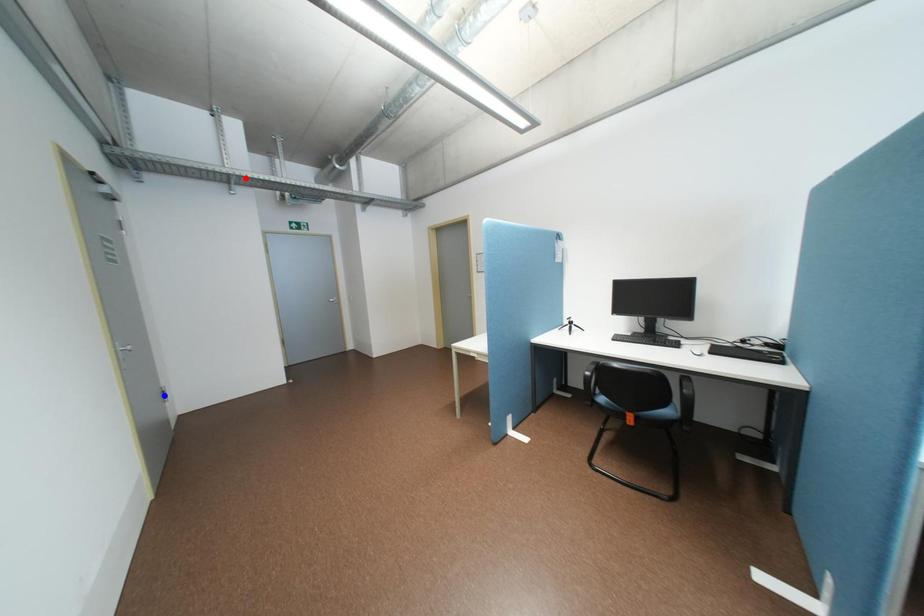
Question: Two points are marked on the image. Which point is closer to the camera?

Choices:
 (A) Blue point is closer.
 (B) Red point is closer.

Answer: (A)